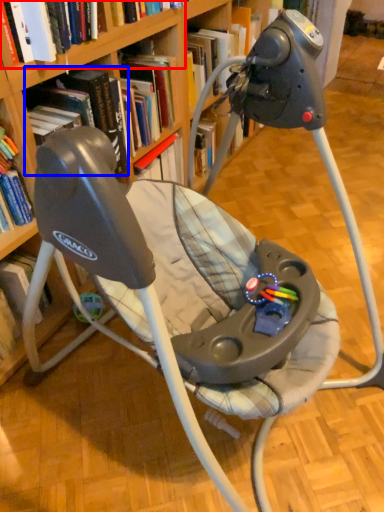
Question: Which point is further to the camera, book (highlighted by a red box) or book (highlighted by a blue box)?

Choices:
 (A) book
 (B) book

Answer: (B)